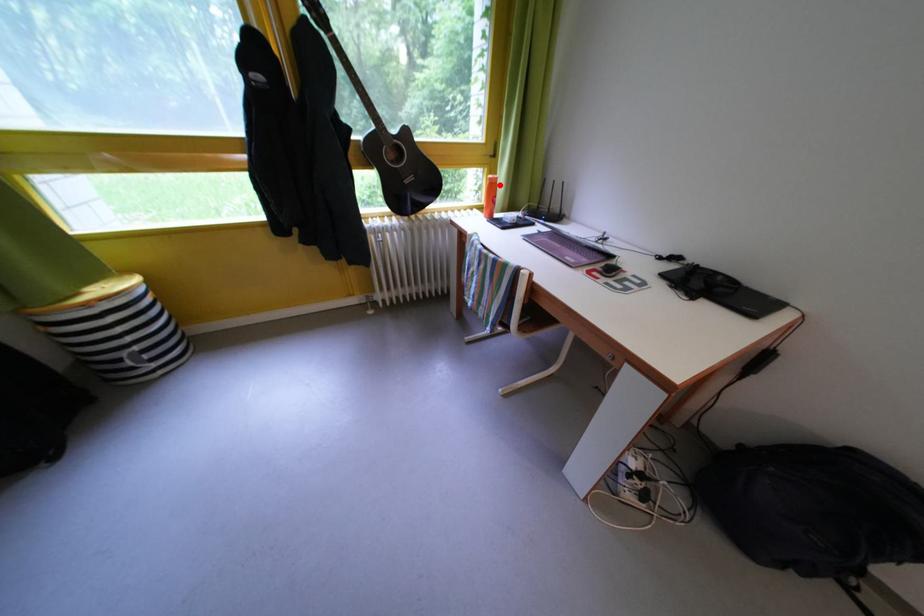
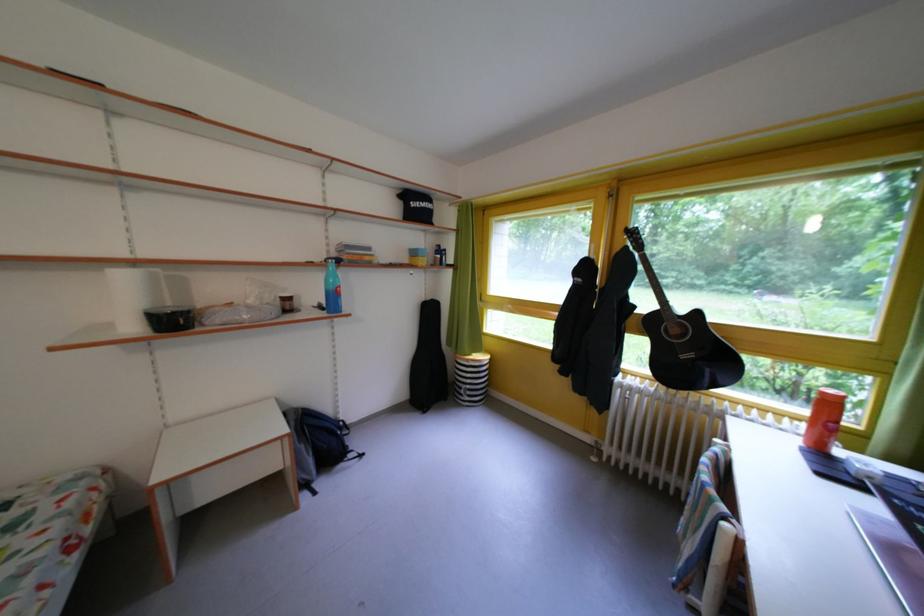
Find the pixel in the second image that matches the highlighted location in the first image.

(833, 399)